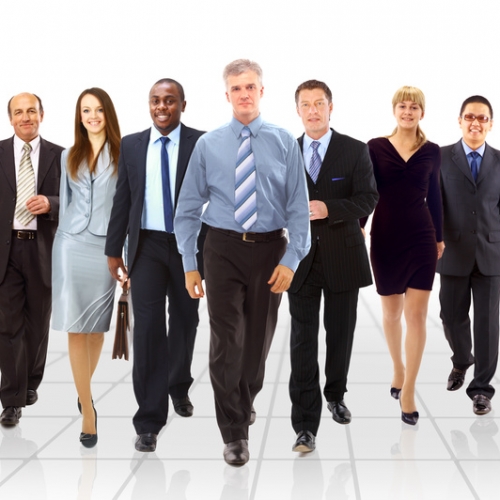
This screenshot has width=500, height=500. Find the location of `light grey floor`. light grey floor is located at coordinates (56, 391), (113, 442), (119, 395), (186, 434), (282, 468), (390, 429), (430, 492), (435, 396), (468, 439).